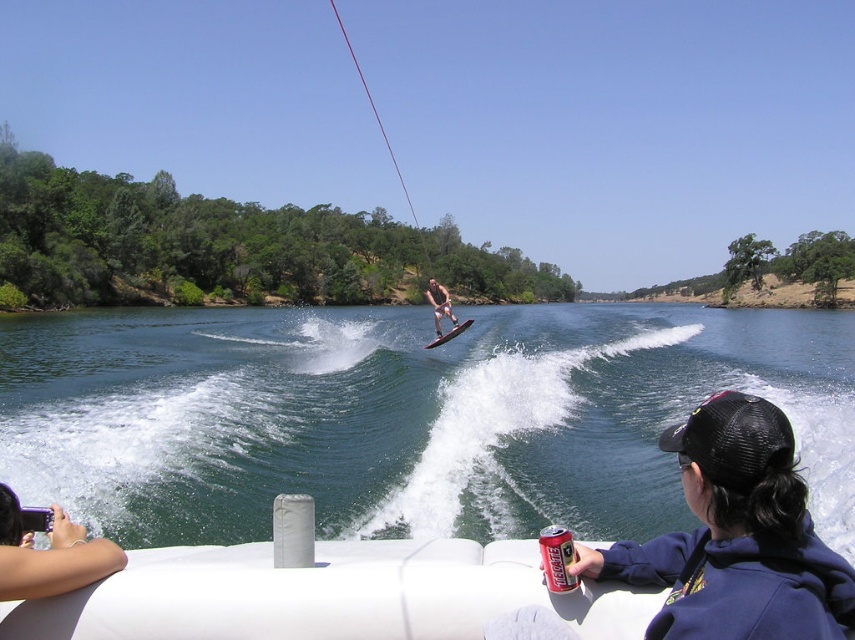
Question: Is clear water at wake center further to the viewer compared to shiny black water ski at center?

Choices:
 (A) no
 (B) yes

Answer: (A)

Question: Is smooth tan skin at center to the left of shiny black water ski at center from the viewer's perspective?

Choices:
 (A) no
 (B) yes

Answer: (B)

Question: Which object appears farthest from the camera in this image?

Choices:
 (A) skinny jeans at lower left
 (B) shiny black water ski at center
 (C) brushed metal can at lower center

Answer: (B)

Question: Is skinny jeans at lower left wider than brushed metal can at lower center?

Choices:
 (A) no
 (B) yes

Answer: (B)

Question: Among these points, which one is nearest to the camera?

Choices:
 (A) (546, 576)
 (B) (18, 596)
 (C) (535, 336)

Answer: (B)

Question: Among these objects, which one is farthest from the camera?

Choices:
 (A) clear water at wake center
 (B) smooth tan skin at center
 (C) brushed metal can at lower center
 (D) shiny black water ski at center

Answer: (D)